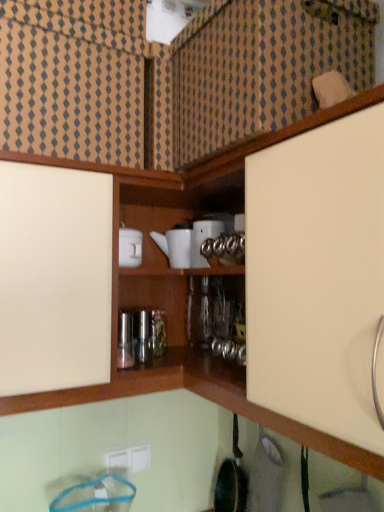
Question: Is white glossy teapot at upper center, the first appliance positioned from the right, next to white plastic electric outlet at lower center and touching it?

Choices:
 (A) yes
 (B) no

Answer: (B)

Question: Is white glossy teapot at upper center, the first appliance positioned from the right, oriented away from white plastic electric outlet at lower center?

Choices:
 (A) no
 (B) yes

Answer: (A)

Question: Can you confirm if white glossy teapot at upper center, the first appliance positioned from the right, is smaller than white plastic electric outlet at lower center?

Choices:
 (A) yes
 (B) no

Answer: (B)

Question: Is white glossy teapot at upper center, arranged as the second appliance when viewed from the left, thinner than white plastic electric outlet at lower center?

Choices:
 (A) no
 (B) yes

Answer: (A)

Question: Is white plastic electric outlet at lower center inside white glossy teapot at upper center, arranged as the second appliance when viewed from the left?

Choices:
 (A) yes
 (B) no

Answer: (B)

Question: From the image's perspective, is white glossy teapot at upper center, the first appliance positioned from the right, above or below white plastic electric outlet at lower center?

Choices:
 (A) below
 (B) above

Answer: (B)

Question: In terms of height, does white glossy teapot at upper center, arranged as the second appliance when viewed from the left, look taller or shorter compared to white plastic electric outlet at lower center?

Choices:
 (A) short
 (B) tall

Answer: (B)

Question: Considering the positions of point (216, 227) and point (114, 451), is point (216, 227) closer or farther from the camera than point (114, 451)?

Choices:
 (A) farther
 (B) closer

Answer: (B)

Question: In the image, is white glossy teapot at upper center, the first appliance positioned from the right, positioned in front of or behind white plastic electric outlet at lower center?

Choices:
 (A) behind
 (B) front

Answer: (B)

Question: Based on their sizes in the image, would you say white ceramic teapot at center, placed as the 1th appliance when sorted from left to right, is bigger or smaller than white plastic electric outlet at lower center?

Choices:
 (A) small
 (B) big

Answer: (B)

Question: Considering their positions, is white ceramic teapot at center, the 2th appliance from the right, located in front of or behind white plastic electric outlet at lower center?

Choices:
 (A) front
 (B) behind

Answer: (A)

Question: Is point (160, 246) positioned closer to the camera than point (107, 459)?

Choices:
 (A) farther
 (B) closer

Answer: (A)

Question: In the image, is white ceramic teapot at center, placed as the 1th appliance when sorted from left to right, on the left side or the right side of white plastic electric outlet at lower center?

Choices:
 (A) right
 (B) left

Answer: (A)

Question: Is white plastic electric outlet at lower center taller or shorter than white ceramic teapot at center, the 2th appliance from the right?

Choices:
 (A) tall
 (B) short

Answer: (B)

Question: From the image's perspective, is white plastic electric outlet at lower center above or below white ceramic teapot at center, placed as the 1th appliance when sorted from left to right?

Choices:
 (A) below
 (B) above

Answer: (A)